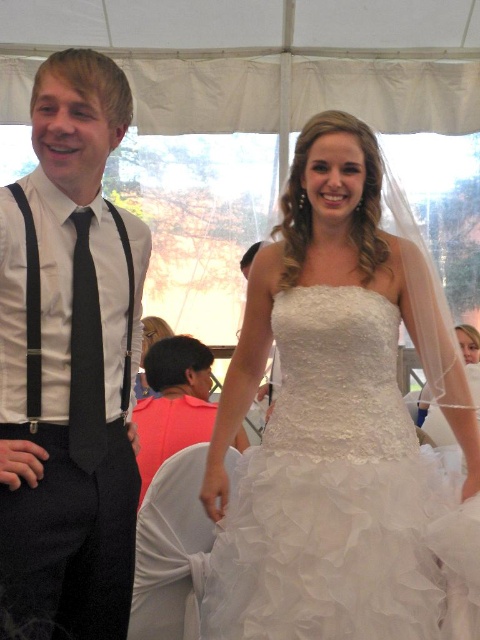
Question: Can you confirm if pink fabric shirt at center is positioned below black satin tie at left?

Choices:
 (A) yes
 (B) no

Answer: (A)

Question: Does pink fabric shirt at center have a lesser width compared to black satin tie at left?

Choices:
 (A) yes
 (B) no

Answer: (B)

Question: Which of the following is the closest to the observer?

Choices:
 (A) pink fabric shirt at center
 (B) white lace dress at center

Answer: (B)

Question: Which is nearer to the pink fabric shirt at center?

Choices:
 (A) black satin tie at left
 (B) white lace dress at center
 (C) matte black tie at left

Answer: (B)

Question: From the image, what is the correct spatial relationship of white lace dress at center in relation to pink fabric shirt at center?

Choices:
 (A) below
 (B) above

Answer: (B)

Question: Which of the following is the farthest from the observer?

Choices:
 (A) white lace dress at center
 (B) black satin tie at left
 (C) matte black tie at left

Answer: (B)